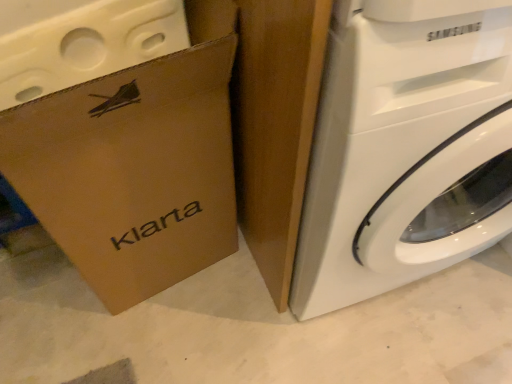
Question: From a real-world perspective, is white glossy washing machine at right above or below brown cardboard box at left?

Choices:
 (A) below
 (B) above

Answer: (B)

Question: In the image, is white glossy washing machine at right on the left side or the right side of brown cardboard box at left?

Choices:
 (A) left
 (B) right

Answer: (B)

Question: In terms of size, does white glossy washing machine at right appear bigger or smaller than brown cardboard box at left?

Choices:
 (A) small
 (B) big

Answer: (B)

Question: Considering the positions of brown cardboard box at left and white glossy washing machine at right in the image, is brown cardboard box at left taller or shorter than white glossy washing machine at right?

Choices:
 (A) short
 (B) tall

Answer: (A)

Question: Is brown cardboard box at left bigger or smaller than white glossy washing machine at right?

Choices:
 (A) big
 (B) small

Answer: (B)

Question: From a real-world perspective, is brown cardboard box at left positioned above or below white glossy washing machine at right?

Choices:
 (A) below
 (B) above

Answer: (A)

Question: Is brown cardboard box at left in front of or behind white glossy washing machine at right in the image?

Choices:
 (A) front
 (B) behind

Answer: (B)